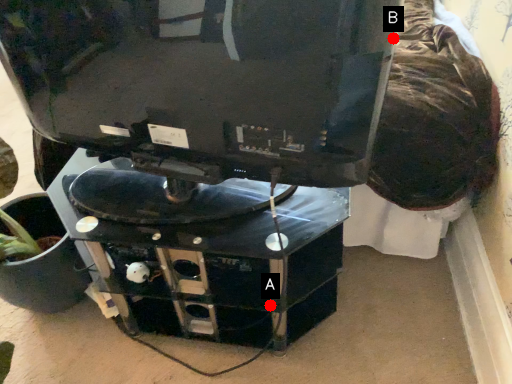
Question: Two points are circled on the image, labeled by A and B beside each circle. Which point is farther from the camera taking this photo?

Choices:
 (A) A is further
 (B) B is further

Answer: (A)